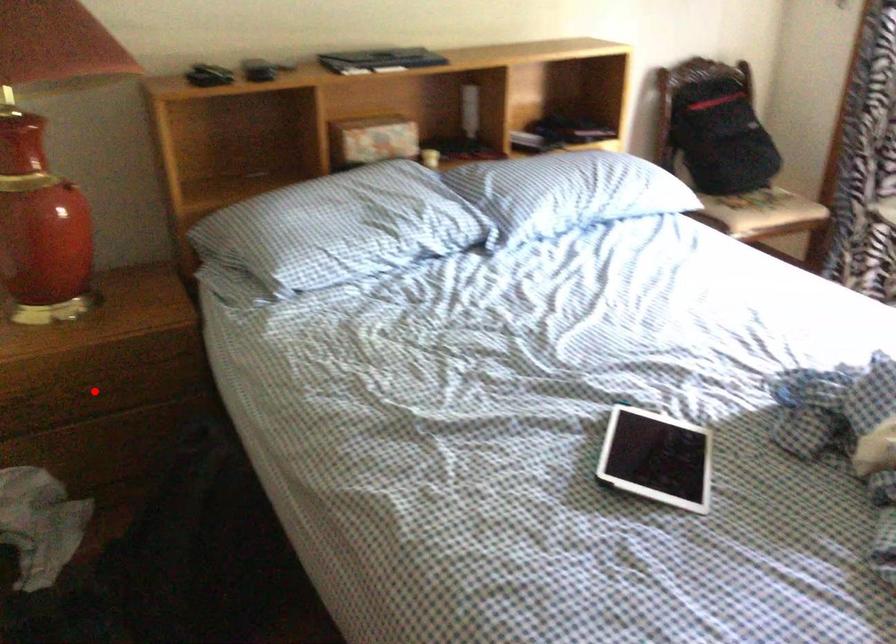
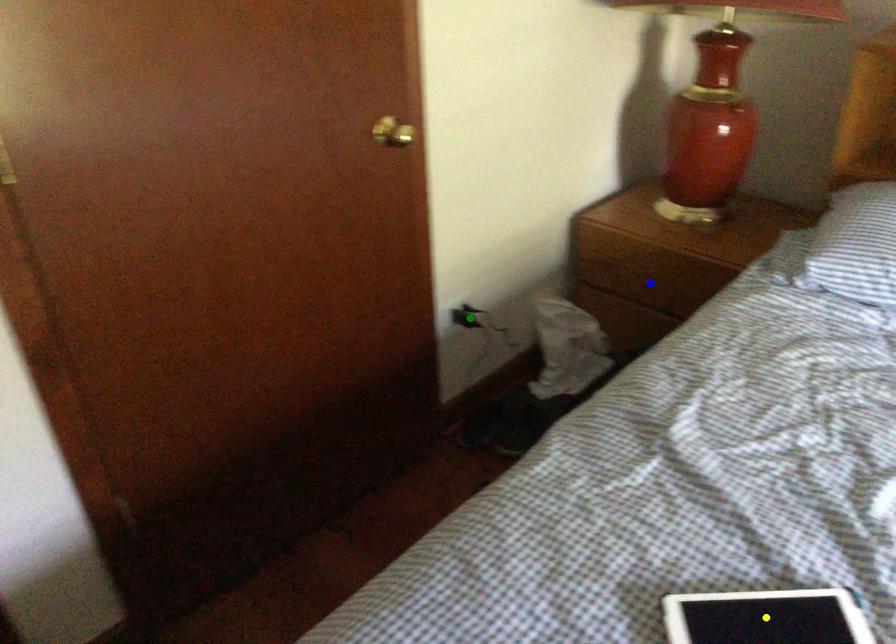
Question: I am providing you with two images of the same scene from different viewpoints. A red point is marked on the first image. You are given multiple points on the second image. Which point in image 2 is actually the same real-world point as the red point in image 1?

Choices:
 (A) green point
 (B) yellow point
 (C) blue point

Answer: (C)